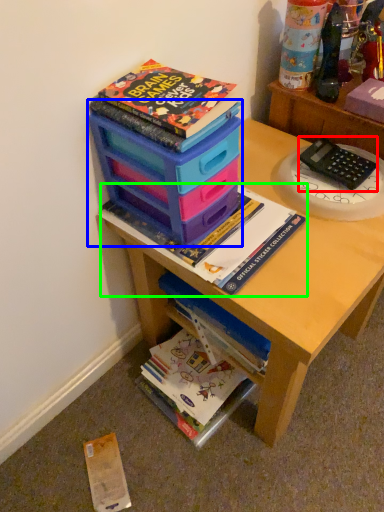
Question: Which object is the closest to the equipment (highlighted by a red box)? Choose among these: storage box (highlighted by a blue box) or book (highlighted by a green box).

Choices:
 (A) storage box
 (B) book

Answer: (B)